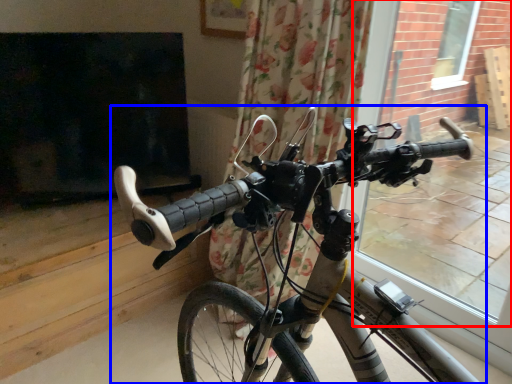
Question: Which point is closer to the camera, window frame (highlighted by a red box) or bicycle (highlighted by a blue box)?

Choices:
 (A) window frame
 (B) bicycle

Answer: (B)